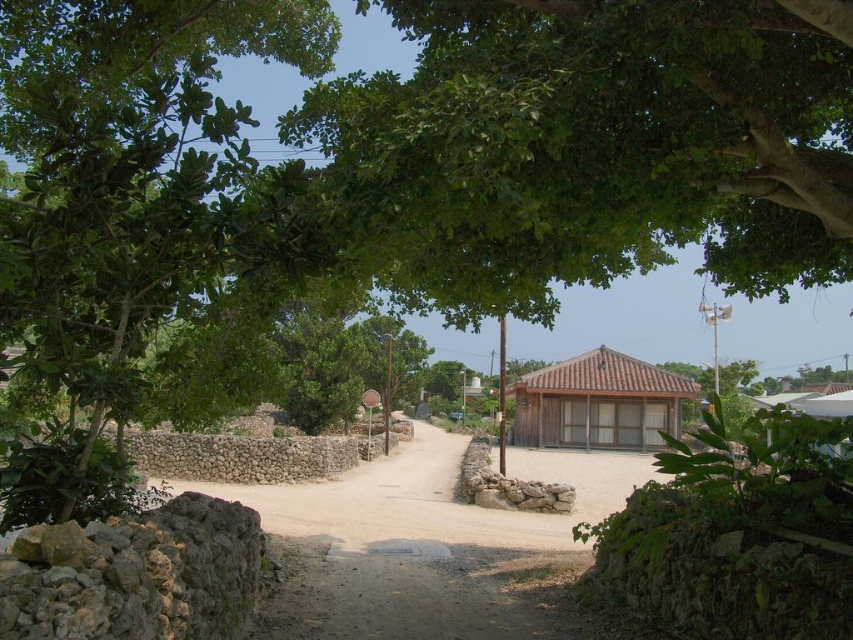
In the rural scene, there is a green leafy tree at left and a brown wooden hut at center. Which object is taller?

The brown wooden hut at center is taller than the green leafy tree at left.